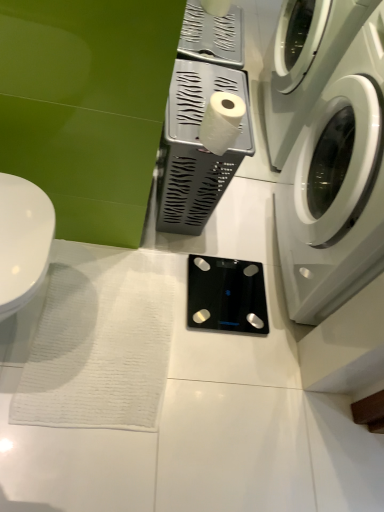
Where is `white glossy washing machine at right`? white glossy washing machine at right is located at coordinates 337,187.

What do you see at coordinates (221, 122) in the screenshot? I see `white matte toilet paper at center` at bounding box center [221, 122].

Describe the element at coordinates (196, 147) in the screenshot. This screenshot has height=512, width=384. I see `white plastic tissue holder at center, which appears as the 2th appliance when ordered from the bottom` at that location.

The image size is (384, 512). What do you see at coordinates (23, 241) in the screenshot?
I see `white glossy toilet at left` at bounding box center [23, 241].

What is the approximate height of white glossy toilet at left?

It is 12.83 inches.

What are the coordinates of `white glossy washing machine at right` in the screenshot? It's located at (337, 187).

Does white glossy toilet at left appear on the left side of white glossy washing machine at right?

Indeed, white glossy toilet at left is positioned on the left side of white glossy washing machine at right.

Based on their sizes in the image, would you say white glossy toilet at left is bigger or smaller than white glossy washing machine at right?

In the image, white glossy toilet at left appears to be smaller than white glossy washing machine at right.

Does white glossy toilet at left have a lesser width compared to white glossy washing machine at right?

Yes.

Is white glossy washing machine at right inside the boundaries of black glass scale at center, acting as the 2th appliance starting from the top, or outside?

white glossy washing machine at right cannot be found inside black glass scale at center, acting as the 2th appliance starting from the top.

Which is behind, white glossy washing machine at right or black glass scale at center, which is the first appliance in bottom-to-top order?

black glass scale at center, which is the first appliance in bottom-to-top order, is more distant.

From the image's perspective, between white glossy washing machine at right and black glass scale at center, which is the first appliance in bottom-to-top order, who is located below?

black glass scale at center, which is the first appliance in bottom-to-top order, appears lower in the image.

Considering the positions of point (340, 168) and point (266, 317), is point (340, 168) closer or farther from the camera than point (266, 317)?

Point (340, 168) appears to be closer to the viewer than point (266, 317).

Which point is more forward, (215,99) or (42,247)?

The point (42,247) is closer to the camera.

From the image's perspective, between white matte toilet paper at center and white glossy toilet at left, who is located below?

white glossy toilet at left.

Is white matte toilet paper at center beside white glossy toilet at left?

No.

From a real-world perspective, is white matte toilet paper at center physically below white glossy toilet at left?

No, from a real-world perspective, white matte toilet paper at center is not beneath white glossy toilet at left.

Visually, is white glossy washing machine at right positioned to the left or to the right of white plastic tissue holder at center, which appears as the 2th appliance when ordered from the bottom?

Clearly, white glossy washing machine at right is on the right of white plastic tissue holder at center, which appears as the 2th appliance when ordered from the bottom, in the image.

Which object is closer to the camera taking this photo, white glossy washing machine at right or white plastic tissue holder at center, placed as the first appliance when sorted from top to bottom?

white glossy washing machine at right is in front.

Who is taller, white glossy washing machine at right or white plastic tissue holder at center, placed as the first appliance when sorted from top to bottom?

With more height is white glossy washing machine at right.

Identify the location of the 1st appliance positioned below the white glossy washing machine at right (from a real-world perspective). The height and width of the screenshot is (512, 384). (196, 147).

From a real-world perspective, between white glossy washing machine at right and white matte toilet paper at center, who is vertically higher?

From a 3D spatial view, white matte toilet paper at center is above.

In the scene shown: How far apart are white glossy washing machine at right and white matte toilet paper at center?

A distance of 15.12 inches exists between white glossy washing machine at right and white matte toilet paper at center.

Is white matte toilet paper at center at the back of white glossy washing machine at right?

That's right, white glossy washing machine at right is facing away from white matte toilet paper at center.

Is white glossy washing machine at right directly adjacent to white matte toilet paper at center?

There is a gap between white glossy washing machine at right and white matte toilet paper at center.

Which is behind, point (183, 114) or point (312, 246)?

The point (312, 246) is more distant.

Which is in front, white plastic tissue holder at center, placed as the first appliance when sorted from top to bottom, or white glossy washing machine at right?

Positioned in front is white glossy washing machine at right.

How different are the orientations of white plastic tissue holder at center, placed as the first appliance when sorted from top to bottom, and white glossy washing machine at right in degrees?

white plastic tissue holder at center, placed as the first appliance when sorted from top to bottom, and white glossy washing machine at right are facing 180 degrees away from each other.

Based on their positions, is white plastic tissue holder at center, which appears as the 2th appliance when ordered from the bottom, located to the left or right of white glossy washing machine at right?

From the image, it's evident that white plastic tissue holder at center, which appears as the 2th appliance when ordered from the bottom, is to the left of white glossy washing machine at right.

From the image's perspective, does white glossy toilet at left appear lower than white plastic tissue holder at center, which appears as the 2th appliance when ordered from the bottom?

Correct, white glossy toilet at left appears lower than white plastic tissue holder at center, which appears as the 2th appliance when ordered from the bottom, in the image.

Could you measure the distance between white glossy toilet at left and white plastic tissue holder at center, which appears as the 2th appliance when ordered from the bottom?

They are 51.40 centimeters apart.

Does white glossy toilet at left have a lesser height compared to white plastic tissue holder at center, placed as the first appliance when sorted from top to bottom?

Yes, white glossy toilet at left is shorter than white plastic tissue holder at center, placed as the first appliance when sorted from top to bottom.

Is white glossy toilet at left facing away from white plastic tissue holder at center, which appears as the 2th appliance when ordered from the bottom?

That's not correct — white glossy toilet at left is not looking away from white plastic tissue holder at center, which appears as the 2th appliance when ordered from the bottom.

Where is `washing machine that is above the white glossy toilet at left (from a real-world perspective)`? This screenshot has width=384, height=512. washing machine that is above the white glossy toilet at left (from a real-world perspective) is located at coordinates (337, 187).

Locate an element on the screen. Image resolution: width=384 pixels, height=512 pixels. washing machine lying in front of the black glass scale at center, acting as the 2th appliance starting from the top is located at coordinates coord(337,187).

Considering their positions, is white glossy toilet at left positioned further to black glass scale at center, acting as the 2th appliance starting from the top, than white matte toilet paper at center?

The object further to black glass scale at center, acting as the 2th appliance starting from the top, is white glossy toilet at left.

From the image, which object appears to be nearer to white glossy washing machine at right, black glass scale at center, which is the first appliance in bottom-to-top order, or white matte toilet paper at center?

black glass scale at center, which is the first appliance in bottom-to-top order, is closer to white glossy washing machine at right.

Considering their positions, is white glossy toilet at left positioned closer to white matte toilet paper at center than white glossy washing machine at right?

white glossy washing machine at right is positioned closer to the anchor white matte toilet paper at center.

Which object lies nearer to the anchor point white glossy toilet at left, white glossy washing machine at right or black glass scale at center, acting as the 2th appliance starting from the top?

The object closer to white glossy toilet at left is black glass scale at center, acting as the 2th appliance starting from the top.

Considering their positions, is white plastic tissue holder at center, placed as the first appliance when sorted from top to bottom, positioned closer to white glossy toilet at left than white matte toilet paper at center?

The object closer to white glossy toilet at left is white matte toilet paper at center.

Estimate the real-world distances between objects in this image. Which object is further from white matte toilet paper at center, black glass scale at center, acting as the 2th appliance starting from the top, or white glossy washing machine at right?

black glass scale at center, acting as the 2th appliance starting from the top, lies further to white matte toilet paper at center than the other object.

From the picture: When comparing their distances from white glossy washing machine at right, does black glass scale at center, which is the first appliance in bottom-to-top order, or white glossy toilet at left seem further?

white glossy toilet at left is positioned further to the anchor white glossy washing machine at right.

Which object lies nearer to the anchor point white plastic tissue holder at center, which appears as the 2th appliance when ordered from the bottom, white matte toilet paper at center or black glass scale at center, acting as the 2th appliance starting from the top?

Among the two, white matte toilet paper at center is located nearer to white plastic tissue holder at center, which appears as the 2th appliance when ordered from the bottom.

What are the coordinates of `toilet paper between white glossy washing machine at right and black glass scale at center, which is the first appliance in bottom-to-top order, in the front-back direction` in the screenshot? It's located at [x=221, y=122].

This screenshot has height=512, width=384. Find the location of `appliance between white glossy toilet at left and black glass scale at center, which is the first appliance in bottom-to-top order, along the z-axis`. appliance between white glossy toilet at left and black glass scale at center, which is the first appliance in bottom-to-top order, along the z-axis is located at coordinates (196, 147).

I want to click on toilet paper between white glossy toilet at left and white glossy washing machine at right, so click(221, 122).

The width and height of the screenshot is (384, 512). I want to click on appliance between white glossy washing machine at right and black glass scale at center, acting as the 2th appliance starting from the top, in the front-back direction, so click(x=196, y=147).